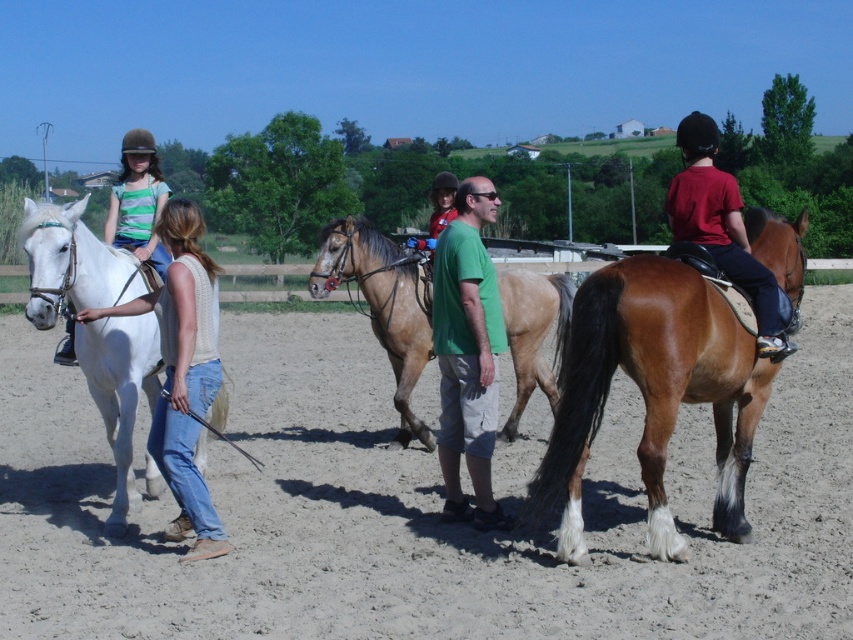
Consider the image. Who is higher up, brown glossy horse at center or matte red shirt at right?

Positioned higher is matte red shirt at right.

Which is in front, point (389, 300) or point (740, 211)?

Point (740, 211) is more forward.

Locate an element on the screen. This screenshot has height=640, width=853. brown glossy horse at center is located at coordinates (384, 305).

You are a GUI agent. You are given a task and a screenshot of the screen. Output one action in this format:
    pyautogui.click(x=<x>, y=<y>)
    Task: Click on the brown glossy horse at center
    
    Given the screenshot: What is the action you would take?
    pyautogui.click(x=384, y=305)

Does white glossy horse at left lie behind matte green shirt at center?

No, it is in front of matte green shirt at center.

Who is more distant from viewer, (36, 202) or (439, 214)?

Point (36, 202)

Identify the location of white glossy horse at left. (73, 262).

In order to click on white glossy horse at left in this screenshot , I will do `click(73, 262)`.

Which is below, gray sand at center or matte green shirt at center?

gray sand at center is lower down.

Find the location of a particular element. The width and height of the screenshot is (853, 640). gray sand at center is located at coordinates (416, 509).

Where is `gray sand at center`? This screenshot has height=640, width=853. gray sand at center is located at coordinates (416, 509).